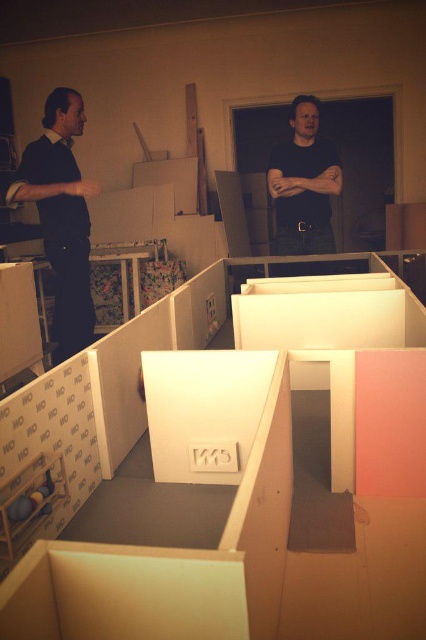
You are organizing a clothing drive and need to know the arrangement of the shirts. Which shirt is positioned to the left of the other between the matte black shirt at left and the dark gray shirt at center?

The matte black shirt at left is positioned to the left of the dark gray shirt at center.